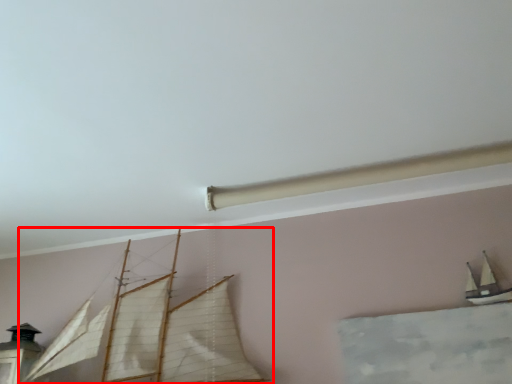
Question: In this image, where is boat (annotated by the red box) located relative to boat?

Choices:
 (A) right
 (B) left

Answer: (B)